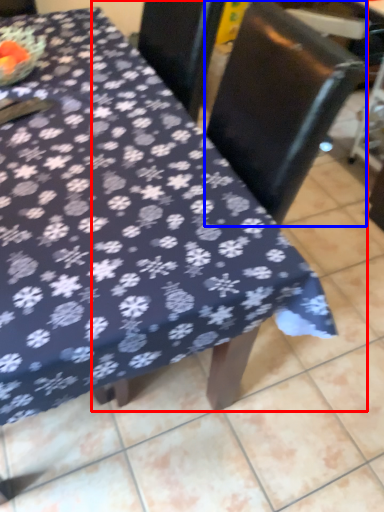
Question: Among these objects, which one is nearest to the camera, chair (highlighted by a red box) or swivel chair (highlighted by a blue box)?

Choices:
 (A) chair
 (B) swivel chair

Answer: (A)